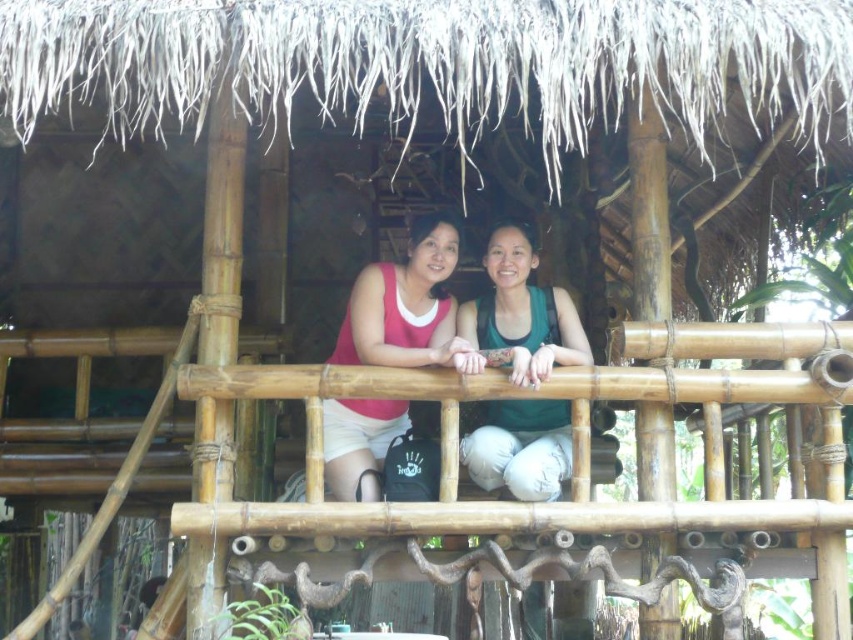
At what (x,y) coordinates should I click in order to perform the action: click on green matte tank top at center. Please return your answer as a coordinate pair (x, y). Looking at the image, I should click on (521, 312).

Is point (492, 257) positioned before point (392, 355)?

No, it is behind (392, 355).

Image resolution: width=853 pixels, height=640 pixels. I want to click on green matte tank top at center, so coord(521,312).